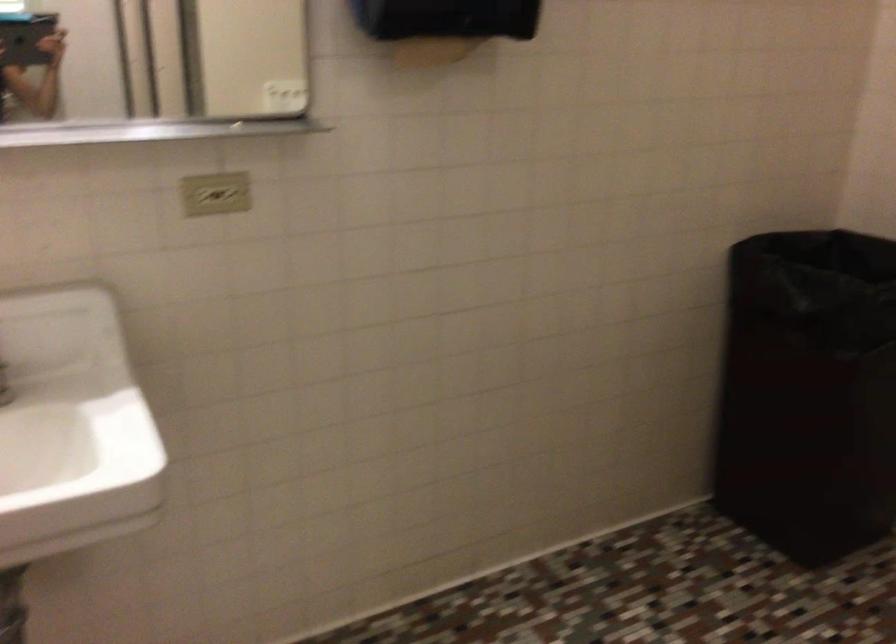
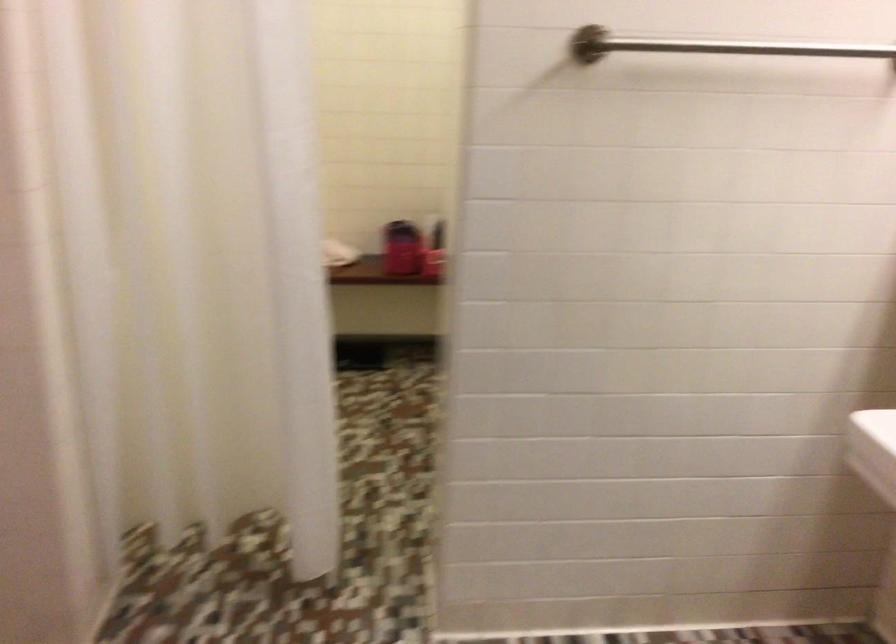
How did the camera likely rotate?

The camera's rotation is toward left-down.